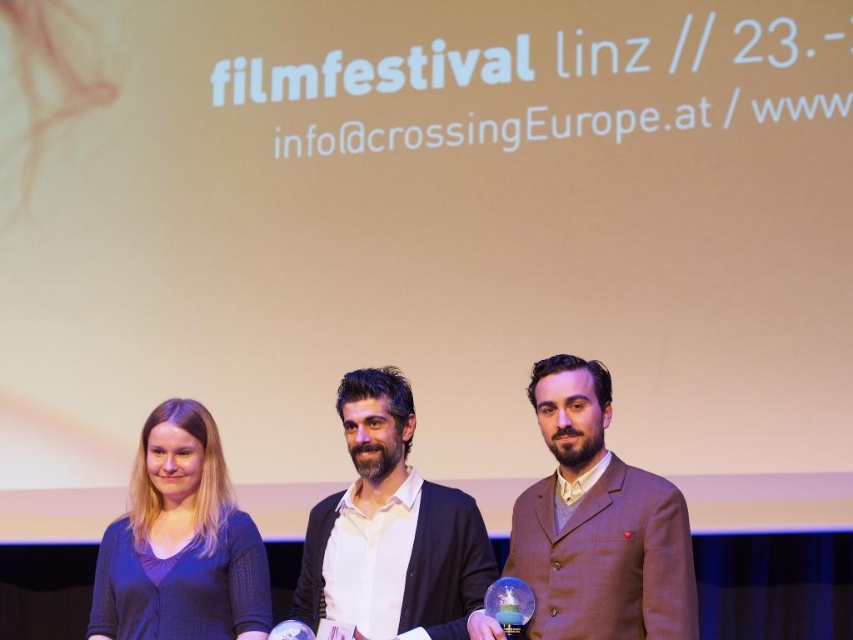
Is brown wool suit at center wider than white matte shirt at center?

No.

Identify the location of brown wool suit at center. (596, 524).

Find the location of a particular element. This screenshot has height=640, width=853. brown wool suit at center is located at coordinates (596, 524).

The image size is (853, 640). What do you see at coordinates (596, 524) in the screenshot? I see `brown wool suit at center` at bounding box center [596, 524].

Which is more to the right, brown wool suit at center or dark blue sweater at left?

From the viewer's perspective, brown wool suit at center appears more on the right side.

Who is more distant from viewer, (628, 621) or (131, 577)?

The point (131, 577) is more distant.

Find the location of a particular element. This screenshot has height=640, width=853. brown wool suit at center is located at coordinates [596, 524].

Which is above, white matte shirt at center or dark blue sweater at left?

Positioned higher is white matte shirt at center.

Does point (456, 490) come behind point (163, 612)?

That is True.

Find the location of a particular element. white matte shirt at center is located at coordinates (390, 529).